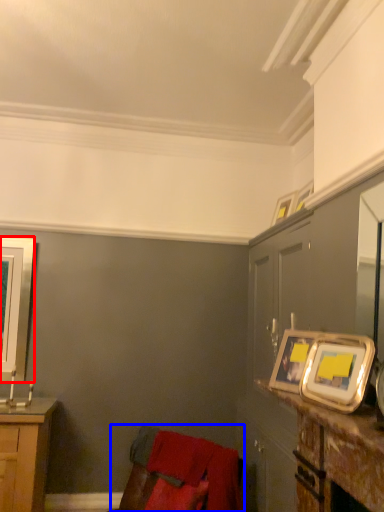
Question: Which object is closer to the camera taking this photo, picture frame (highlighted by a red box) or swivel chair (highlighted by a blue box)?

Choices:
 (A) picture frame
 (B) swivel chair

Answer: (B)